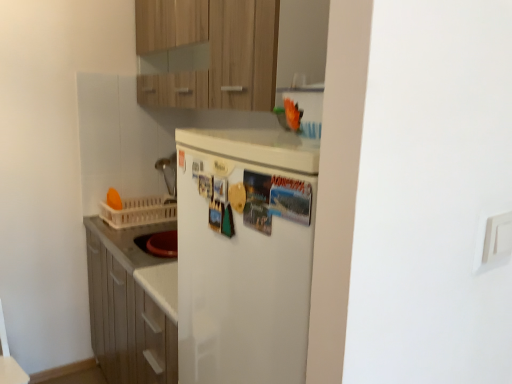
The image size is (512, 384). Describe the element at coordinates (244, 254) in the screenshot. I see `white matte refrigerator at center` at that location.

Where is `wooden cabinet at upper center`? wooden cabinet at upper center is located at coordinates (212, 52).

Does white matte refrigerator at center appear on the left side of white plastic basket at left?

No.

Which of these two, white matte refrigerator at center or white plastic basket at left, is bigger?

white plastic basket at left.

Can you confirm if white matte refrigerator at center is wider than white plastic basket at left?

In fact, white matte refrigerator at center might be narrower than white plastic basket at left.

Is white matte refrigerator at center not within white plastic basket at left?

Yes, white matte refrigerator at center is outside of white plastic basket at left.

Which object is further away from the camera taking this photo, wooden cabinet at upper center or white plastic basket at left?

Positioned behind is white plastic basket at left.

Is wooden cabinet at upper center with white plastic basket at left?

No, wooden cabinet at upper center is not beside white plastic basket at left.

What's the angular difference between wooden cabinet at upper center and white plastic basket at left's facing directions?

The angle between the facing direction of wooden cabinet at upper center and the facing direction of white plastic basket at left is 0.142 degrees.

Is wooden cabinet at upper center looking in the opposite direction of white plastic basket at left?

wooden cabinet at upper center is not turned away from white plastic basket at left.

Measure the distance between wooden cabinet at upper center and white matte refrigerator at center.

64.71 centimeters.

Considering the relative sizes of wooden cabinet at upper center and white matte refrigerator at center in the image provided, is wooden cabinet at upper center taller than white matte refrigerator at center?

Yes.

Is wooden cabinet at upper center far from white matte refrigerator at center?

No, wooden cabinet at upper center is not far from white matte refrigerator at center.

Find the location of `refrigerator below the wooden cabinet at upper center (from the image's perspective)`. refrigerator below the wooden cabinet at upper center (from the image's perspective) is located at coordinates (244, 254).

Measure the distance from white plastic basket at left to wooden cabinet at upper center.

30.55 inches.

From the picture: Does white plastic basket at left lie behind wooden cabinet at upper center?

Yes, white plastic basket at left is further from the viewer.

Is white plastic basket at left at the left side of wooden cabinet at upper center?

Yes, white plastic basket at left is to the left of wooden cabinet at upper center.

This screenshot has height=384, width=512. Find the location of `basket behind the wooden cabinet at upper center`. basket behind the wooden cabinet at upper center is located at coordinates (140, 211).

Can you confirm if white plastic basket at left is wider than white matte refrigerator at center?

Correct, the width of white plastic basket at left exceeds that of white matte refrigerator at center.

Which object is closer to the camera, white plastic basket at left or white matte refrigerator at center?

white matte refrigerator at center.

From a real-world perspective, which object rests below the other?

From a 3D spatial view, white plastic basket at left is below.

Visually, is white plastic basket at left positioned to the left or to the right of white matte refrigerator at center?

Based on their positions, white plastic basket at left is located to the left of white matte refrigerator at center.

From the image's perspective, is white matte refrigerator at center under wooden cabinet at upper center?

Correct, white matte refrigerator at center appears lower than wooden cabinet at upper center in the image.

From a real-world perspective, is white matte refrigerator at center on wooden cabinet at upper center?

Incorrect, from a real-world perspective, white matte refrigerator at center is lower than wooden cabinet at upper center.

Is wooden cabinet at upper center inside white matte refrigerator at center?

No, wooden cabinet at upper center is not inside white matte refrigerator at center.

Is point (286, 368) closer to viewer compared to point (236, 79)?

Yes.

At what (x,y) coordinates should I click in order to perform the action: click on basket below the white matte refrigerator at center (from a real-world perspective). Please return your answer as a coordinate pair (x, y). Looking at the image, I should click on (140, 211).

Locate an element on the screen. Image resolution: width=512 pixels, height=384 pixels. cabinetry above the white plastic basket at left (from the image's perspective) is located at coordinates (212, 52).

Considering their positions, is wooden cabinet at upper center positioned further to white matte refrigerator at center than white plastic basket at left?

Among the two, white plastic basket at left is located further to white matte refrigerator at center.

Estimate the real-world distances between objects in this image. Which object is closer to wooden cabinet at upper center, white matte refrigerator at center or white plastic basket at left?

white matte refrigerator at center is closer to wooden cabinet at upper center.

When comparing their distances from white plastic basket at left, does white matte refrigerator at center or wooden cabinet at upper center seem closer?

wooden cabinet at upper center is closer to white plastic basket at left.

Estimate the real-world distances between objects in this image. Which object is closer to white matte refrigerator at center, white plastic basket at left or wooden cabinet at upper center?

Among the two, wooden cabinet at upper center is located nearer to white matte refrigerator at center.

Which object lies nearer to the anchor point white plastic basket at left, wooden cabinet at upper center or white matte refrigerator at center?

Among the two, wooden cabinet at upper center is located nearer to white plastic basket at left.

Based on their spatial positions, is white plastic basket at left or white matte refrigerator at center further from wooden cabinet at upper center?

white plastic basket at left lies further to wooden cabinet at upper center than the other object.

Find the location of `cabinetry positioned between white matte refrigerator at center and white plastic basket at left from near to far`. cabinetry positioned between white matte refrigerator at center and white plastic basket at left from near to far is located at coordinates (212, 52).